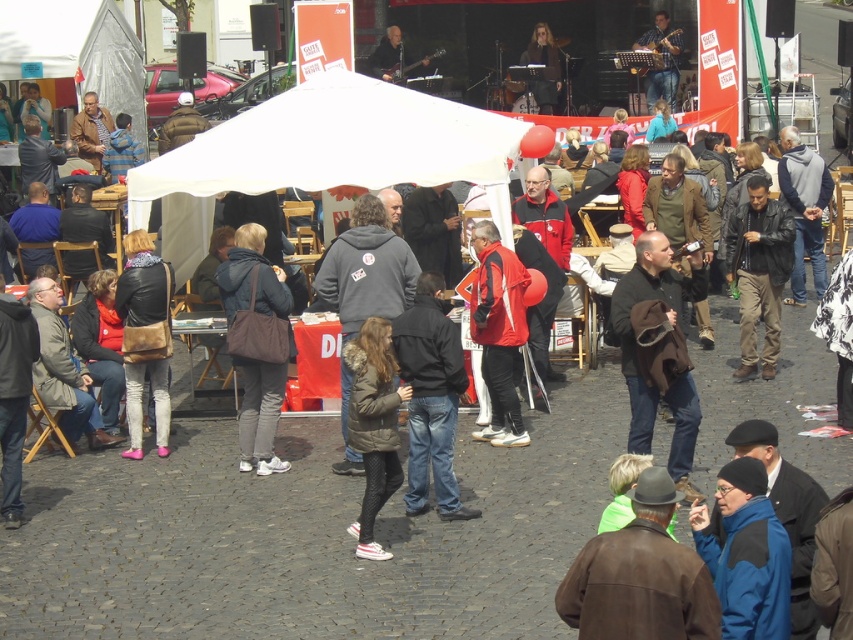
Question: Which point is closer to the camera taking this photo?

Choices:
 (A) click(161, 314)
 (B) click(538, 99)
 (C) click(409, 493)
 (D) click(485, 276)

Answer: (C)

Question: Is leather jacket at right thinner than leather jacket at center?

Choices:
 (A) yes
 (B) no

Answer: (B)

Question: Does brown leather jacket at lower right have a greater width compared to matte brown bag at center?

Choices:
 (A) no
 (B) yes

Answer: (B)

Question: Which of the following is the farthest from the observer?

Choices:
 (A) (688, 420)
 (B) (543, 99)
 (C) (498, 422)

Answer: (B)

Question: Which object is the closest to the dark green textured coat at center?

Choices:
 (A) matte brown bag at center
 (B) dark brown leather jacket at center
 (C) brown leather jacket at lower right
 (D) leather jacket at right

Answer: (A)

Question: Can you confirm if leather jacket at center is positioned below shiny black hair at upper center?

Choices:
 (A) no
 (B) yes

Answer: (B)